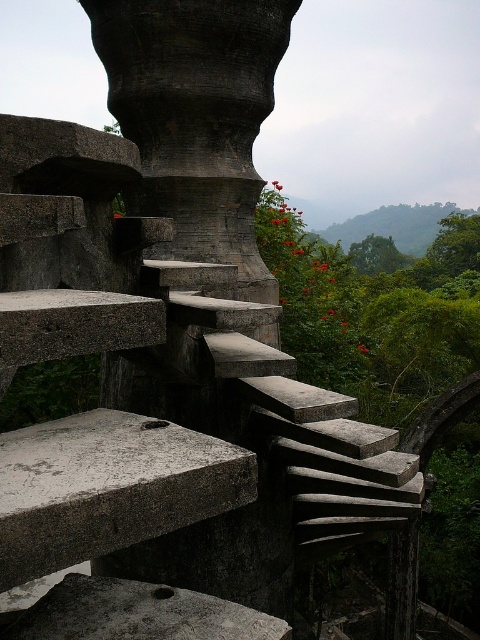
You are standing at the base of the spiral staircase and want to place a small potted plant between the dark gray stone pillar at center and the gray concrete at lower left. Based on their positions, where should you place the plant?

The gray concrete at lower left is behind the dark gray stone pillar at center, so you should place the potted plant in front of the dark gray stone pillar at center, between it and the gray concrete at lower left.

In the scene shown: You are standing at the bottom of the gray concrete stairs at center. You want to reach the top of the spiral staircase. Considering the distance between you and the stairs is 1.88 meters, how many steps would you need to climb to reach the top?

The question cannot be answered with the given information because the number of steps required to climb the gray concrete stairs at center depends on the height of each step and the total height of the staircase, which are not provided in the description.